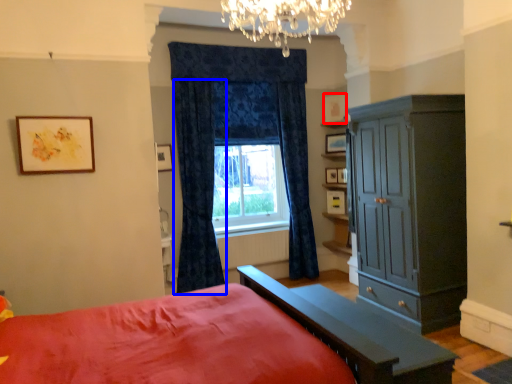
Question: Among these objects, which one is farthest to the camera, picture frame (highlighted by a red box) or curtain (highlighted by a blue box)?

Choices:
 (A) picture frame
 (B) curtain

Answer: (A)